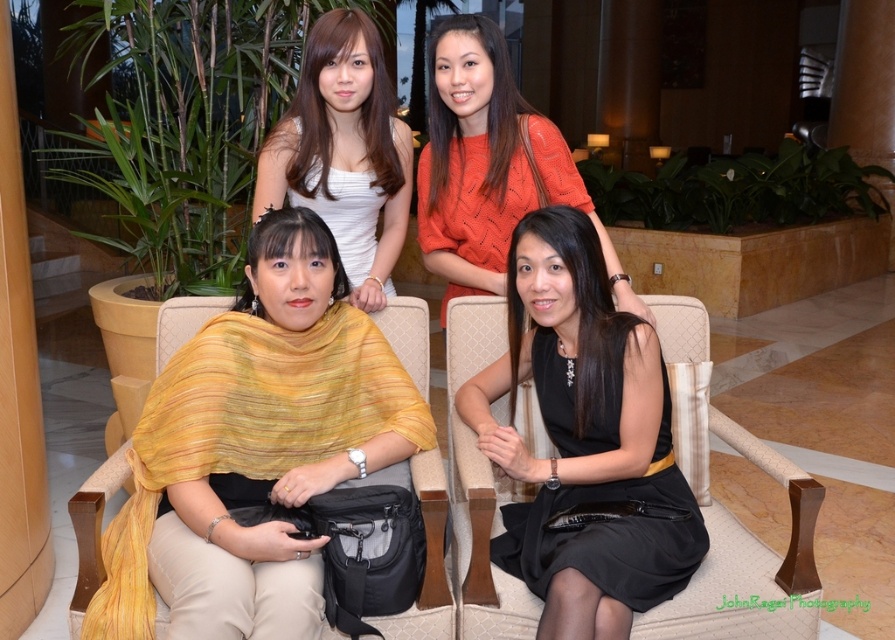
Can you confirm if yellow textured shawl at center is thinner than orange knitwear at upper center?

No.

Is yellow textured shawl at center smaller than orange knitwear at upper center?

Yes.

The width and height of the screenshot is (895, 640). I want to click on yellow textured shawl at center, so click(266, 436).

Identify the location of yellow textured shawl at center. (266, 436).

Is yellow textured shawl at center smaller than black satin dress at center?

Actually, yellow textured shawl at center might be larger than black satin dress at center.

Which of these two, yellow textured shawl at center or black satin dress at center, stands shorter?

Standing shorter between the two is black satin dress at center.

Identify the location of yellow textured shawl at center. The image size is (895, 640). (266, 436).

This screenshot has width=895, height=640. What are the coordinates of `yellow textured shawl at center` in the screenshot? It's located at (266, 436).

Does orange knitwear at upper center have a lesser height compared to white satin dress at upper center?

No.

Does orange knitwear at upper center have a greater width compared to white satin dress at upper center?

Answer: Yes, orange knitwear at upper center is wider than white satin dress at upper center.

Does point (480, 172) come behind point (344, 253)?

That is False.

Find the location of `orange knitwear at upper center`. orange knitwear at upper center is located at coordinates (490, 164).